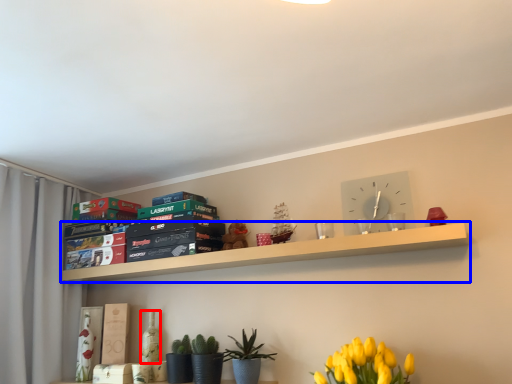
Question: Which object appears farthest to the camera in this image, bottle (highlighted by a red box) or shelf (highlighted by a blue box)?

Choices:
 (A) bottle
 (B) shelf

Answer: (A)